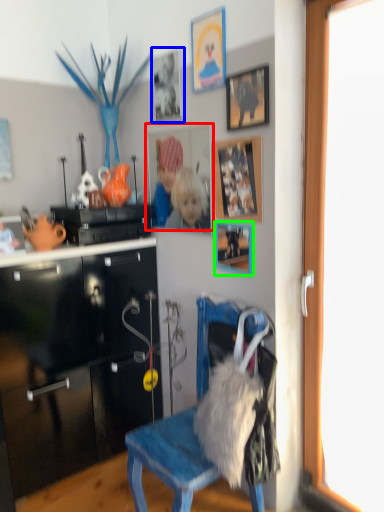
Question: Which object is positioned farthest from picture frame (highlighted by a red box)? Select from picture frame (highlighted by a blue box) and picture frame (highlighted by a green box).

Choices:
 (A) picture frame
 (B) picture frame

Answer: (B)